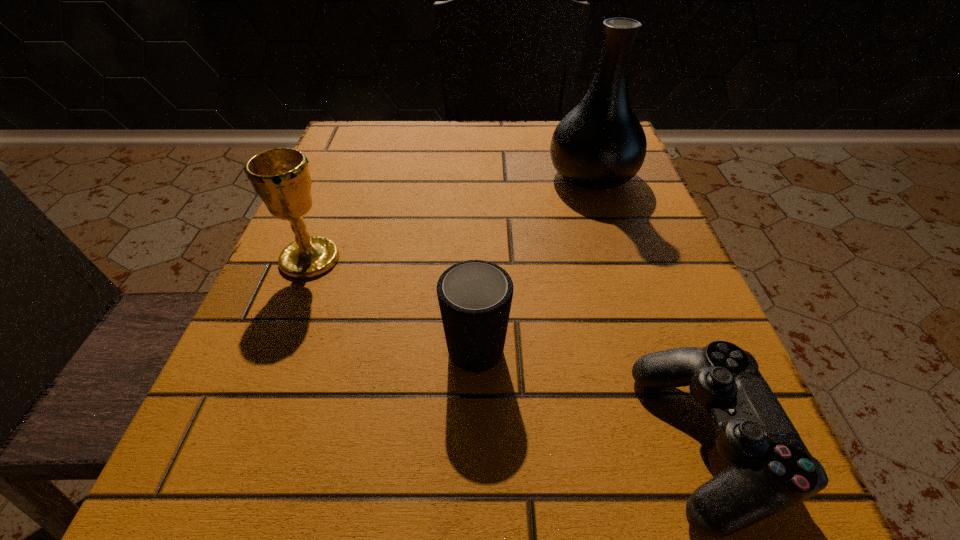
Image resolution: width=960 pixels, height=540 pixels. Identify the location of vacant space at the near left corner of the desktop. (287, 511).

Locate an element on the screen. This screenshot has height=540, width=960. free space between the third shortest object and the third object from right to left is located at coordinates (393, 299).

The width and height of the screenshot is (960, 540). What are the coordinates of `free space between the third nearest object and the second shortest object` in the screenshot? It's located at (393, 299).

Locate an element on the screen. vacant region between the leftmost object and the mug is located at coordinates (393, 299).

I want to click on vacant space that's between the third tallest object and the third nearest object, so click(x=393, y=299).

You are a GUI agent. You are given a task and a screenshot of the screen. Output one action in this format:
    pyautogui.click(x=<x>, y=<y>)
    Task: Click on the free spot between the chalice and the second shortest object
    This screenshot has height=540, width=960.
    Given the screenshot: What is the action you would take?
    pyautogui.click(x=393, y=299)

I want to click on vacant point located between the mug and the second tallest object, so click(393, 299).

The width and height of the screenshot is (960, 540). In order to click on vacant area between the mug and the third shortest object in this screenshot , I will do `click(393, 299)`.

I want to click on object that is the third closest to the third nearest object, so click(x=771, y=469).

Identify which object is the nearest to the chalice. Please provide its 2D coordinates. Your answer should be formatted as a tuple, i.e. [(x, y)], where the tuple contains the x and y coordinates of a point satisfying the conditions above.

[(475, 296)]